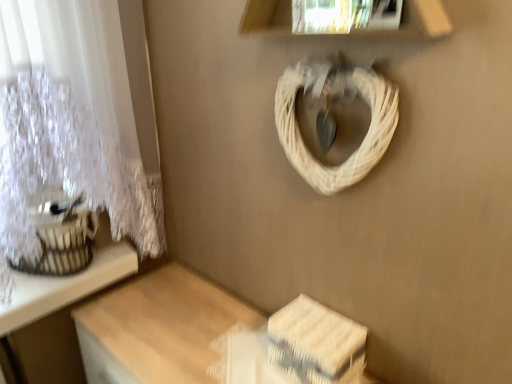
I want to click on blank space above wooden table at lower right (from a real-world perspective), so (192, 335).